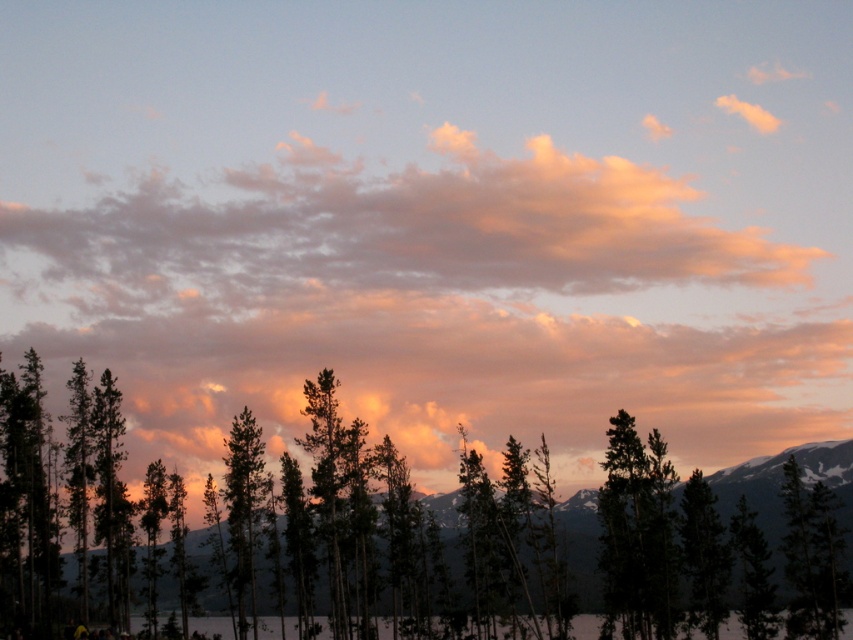
You are an artist trying to paint this landscape. You want to ensure that the dark green textured tree at center and the soft pink cotton clouds at upper center are positioned correctly. According to the scene, which object should appear closer to you when you look at the painting?

The dark green textured tree at center should appear closer because it is in front of the soft pink cotton clouds at upper center.

You are standing at the point marked as point (234, 541) in the image. A friend is standing exactly 108.58 meters away from you in the same direction. Where would your friend be located in the image?

Your friend would be located 108.58 meters away from point (234, 541) in the same direction, which is beyond the visible mountain peaks in the distance.